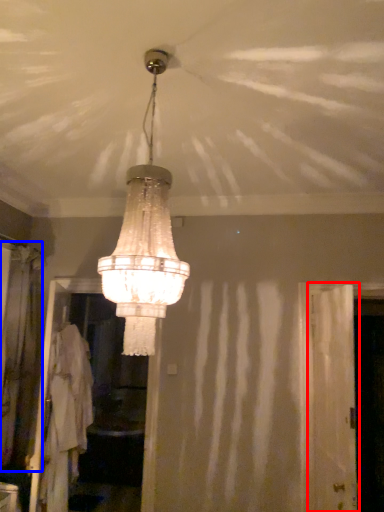
Question: Which object appears farthest to the camera in this image, screen door (highlighted by a red box) or curtain (highlighted by a blue box)?

Choices:
 (A) screen door
 (B) curtain

Answer: (B)